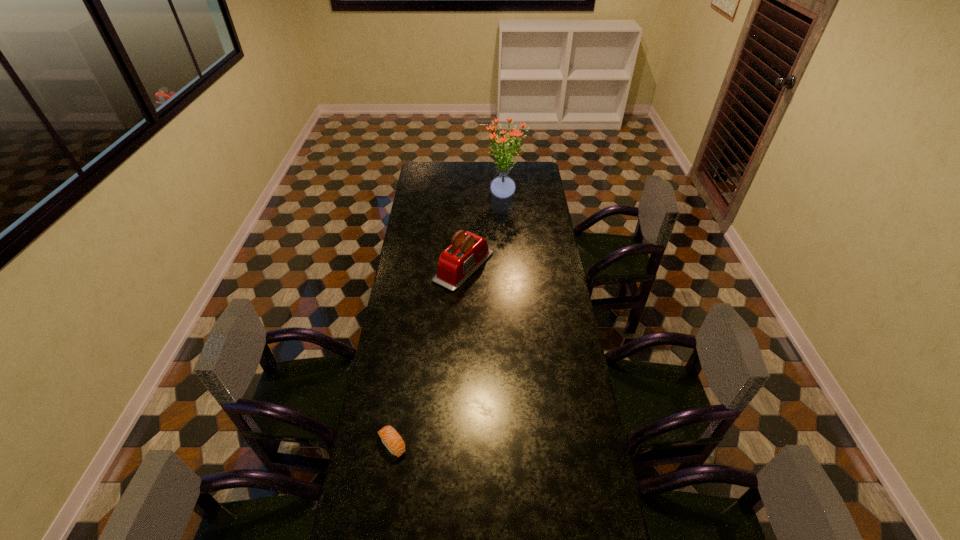
The width and height of the screenshot is (960, 540). In order to click on vacant area that lies between the nearest object and the flower arrangement in this screenshot , I will do `click(448, 320)`.

Locate an element on the screen. This screenshot has width=960, height=540. free area in between the tallest object and the second tallest object is located at coordinates (484, 231).

Where is `vacant region between the second tallest object and the leftmost object`? Image resolution: width=960 pixels, height=540 pixels. vacant region between the second tallest object and the leftmost object is located at coordinates [428, 356].

Locate an element on the screen. Image resolution: width=960 pixels, height=540 pixels. free space between the second farthest object and the flower arrangement is located at coordinates (484, 231).

At what (x,y) coordinates should I click in order to perform the action: click on unoccupied area between the flower arrangement and the second nearest object. Please return your answer as a coordinate pair (x, y). The height and width of the screenshot is (540, 960). Looking at the image, I should click on (484, 231).

Select which object is the second closest to the farthest object. Please provide its 2D coordinates. Your answer should be formatted as a tuple, i.e. [(x, y)], where the tuple contains the x and y coordinates of a point satisfying the conditions above.

[(391, 439)]

Identify the location of object identified as the closest to the toaster. This screenshot has width=960, height=540. (502, 187).

Identify the location of vacant space that satisfies the following two spatial constraints: 1. on the back side of the toaster; 2. on the left side of the leftmost object. The width and height of the screenshot is (960, 540). (419, 267).

At what (x,y) coordinates should I click in order to perform the action: click on vacant space that satisfies the following two spatial constraints: 1. on the back side of the toaster; 2. on the left side of the shortest object. Please return your answer as a coordinate pair (x, y). This screenshot has height=540, width=960. Looking at the image, I should click on (419, 267).